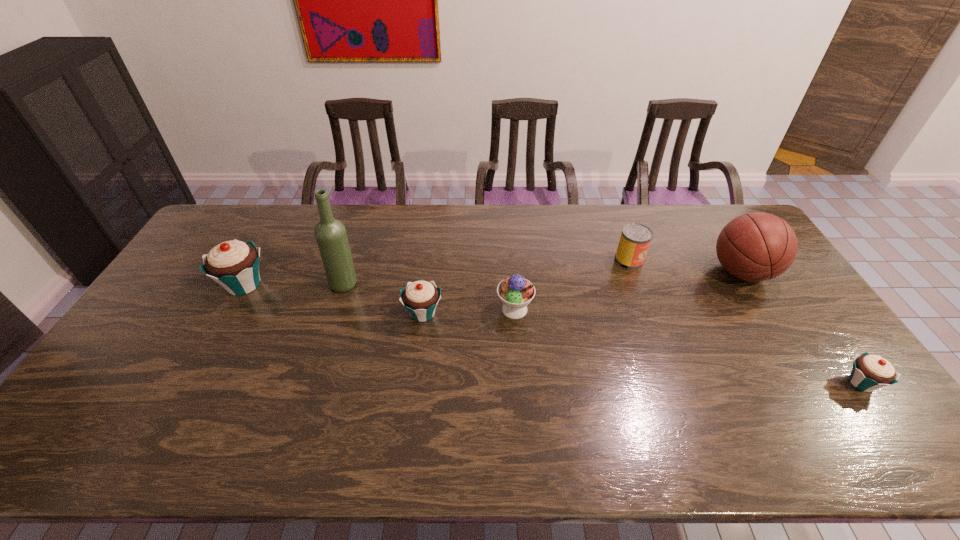
Where is `the closest cupcake to the second cupcake from left to right`? the closest cupcake to the second cupcake from left to right is located at coordinates (234, 264).

The width and height of the screenshot is (960, 540). Find the location of `cupcake that is the second closest to the second object from left to right`. cupcake that is the second closest to the second object from left to right is located at coordinates (234, 264).

This screenshot has height=540, width=960. I want to click on vacant area in the image that satisfies the following two spatial constraints: 1. on the back side of the can; 2. on the left side of the third object from left to right, so click(x=429, y=260).

In order to click on vacant space that satisfies the following two spatial constraints: 1. on the back side of the sixth shortest object; 2. on the left side of the icecream in this screenshot , I will do `click(512, 272)`.